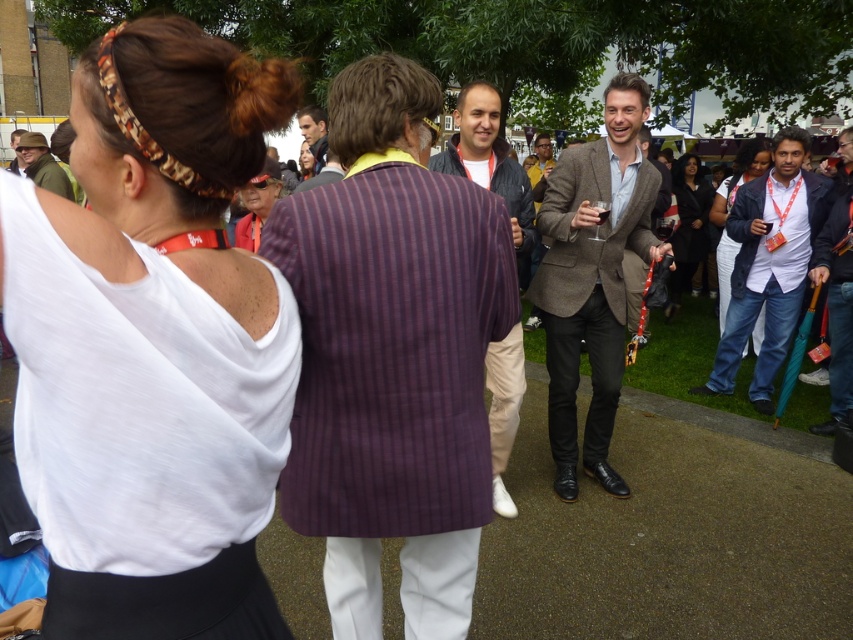
Which is more to the right, matte red shirt at center or matte yellow shirt at center?

matte yellow shirt at center is more to the right.

Is matte red shirt at center positioned in front of matte yellow shirt at center?

Yes, matte red shirt at center is in front of matte yellow shirt at center.

Does point (244, 230) lie behind point (540, 163)?

No, it is not.

At what (x,y) coordinates should I click in order to perform the action: click on matte red shirt at center. Please return your answer as a coordinate pair (x, y). Looking at the image, I should click on (257, 204).

Is matte black dress at center bigger than matte black hair at center?

Indeed, matte black dress at center has a larger size compared to matte black hair at center.

Is the position of matte black dress at center less distant than that of matte black hair at center?

No, matte black dress at center is further to the viewer.

Identify the location of matte black dress at center. (688, 225).

Based on the photo, is khaki fabric hat at upper left shorter than matte black hair at center?

No, khaki fabric hat at upper left is not shorter than matte black hair at center.

The height and width of the screenshot is (640, 853). What do you see at coordinates (44, 164) in the screenshot?
I see `khaki fabric hat at upper left` at bounding box center [44, 164].

Image resolution: width=853 pixels, height=640 pixels. In order to click on khaki fabric hat at upper left in this screenshot , I will do `click(44, 164)`.